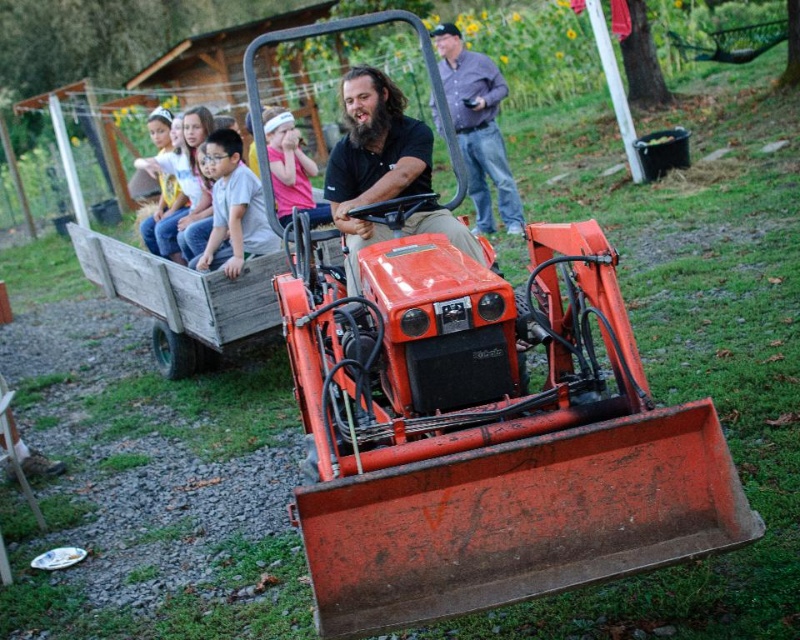
Question: Which object is closer to the camera taking this photo?

Choices:
 (A) matte black tractor at center
 (B) pink fabric headband at upper center
 (C) brushed metal camera at upper center

Answer: (A)

Question: In this image, where is matte black tractor at center located relative to light gray cotton shirt at center?

Choices:
 (A) below
 (B) above

Answer: (B)

Question: Which object appears farthest from the camera in this image?

Choices:
 (A) brushed metal camera at upper center
 (B) light gray cotton shirt at center
 (C) pink fabric headband at upper center

Answer: (A)

Question: Is matte black tractor at center to the left of light gray cotton shirt at center from the viewer's perspective?

Choices:
 (A) yes
 (B) no

Answer: (B)

Question: Which point is closer to the camera taking this photo?

Choices:
 (A) coord(220,152)
 (B) coord(366,80)
 (C) coord(285,216)
 (D) coord(446,61)

Answer: (B)

Question: Is matte black tractor at center thinner than light gray cotton shirt at center?

Choices:
 (A) no
 (B) yes

Answer: (A)